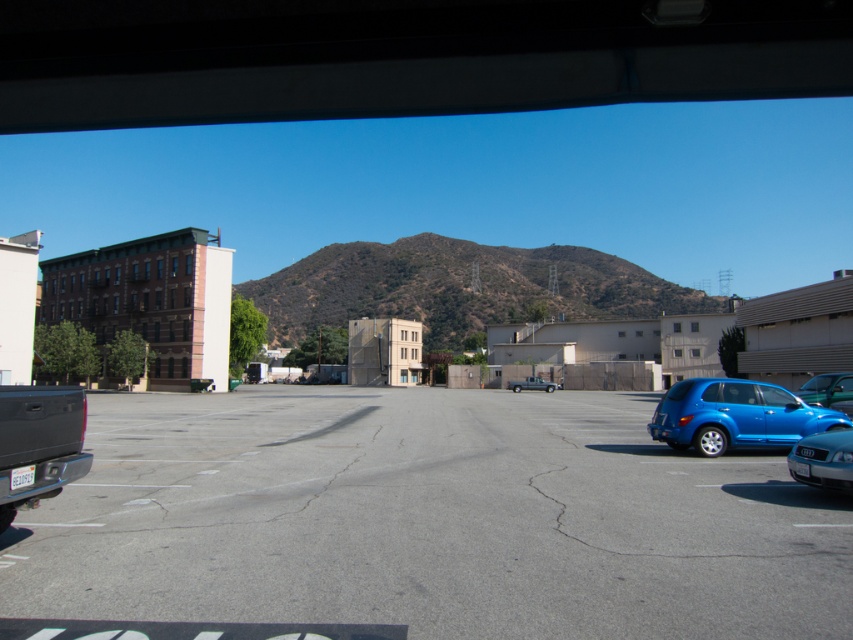
You are a delivery driver who needs to park your truck in the parking lot. You see a blue matte car at lower right and a silver metallic sedan at lower right. Which vehicle takes up more space in the parking spot?

The blue matte car at lower right has a larger size compared to the silver metallic sedan at lower right, so it takes up more space in the parking spot.

Consider the image. You are a delivery person trying to park your van in the parking lot. You see the matte black truck at lower left and the silver metallic sedan at lower right. Which vehicle is blocking your path closer to the entrance?

The matte black truck at lower left is positioned over the silver metallic sedan at lower right, so the matte black truck at lower left is closer to the entrance and is blocking your path.

You are a delivery driver who needs to park your truck in the parking lot. You see the blue matte car at lower right and the silver metallic sedan at lower right. Which vehicle should you avoid parking next to if you need to leave first?

You should avoid parking next to the blue matte car at lower right because it is much taller than the silver metallic sedan at lower right, which might block your truck when leaving.